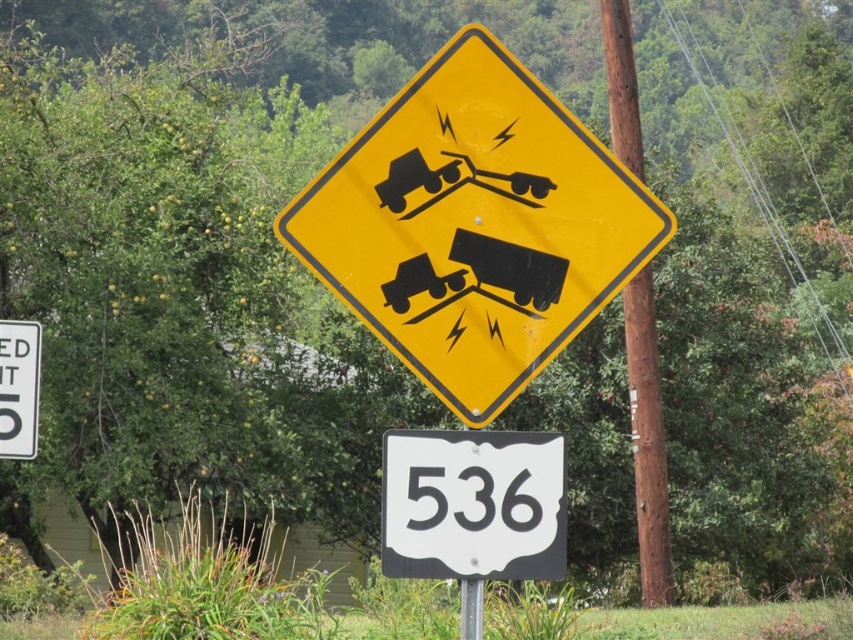
You are standing at the point labeled point (647, 440). Which object is directly in front of you?

The point (647, 440) indicates a brown wooden pole at center right, so the brown wooden pole at center right is directly in front of you.